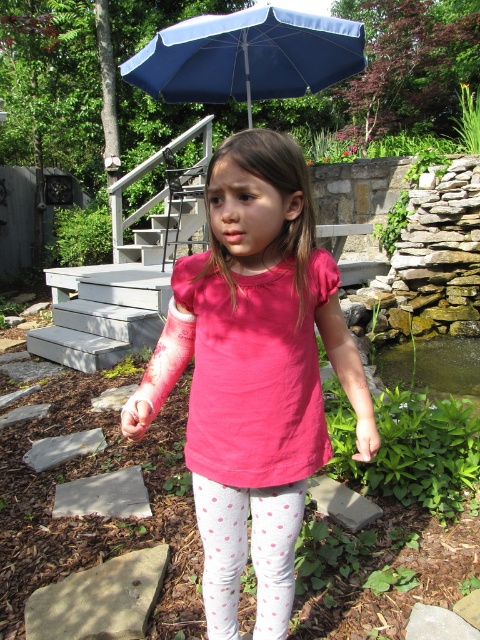
Measure the distance from pink fabric shirt at center to white polka dot leggings at lower center.

5.25 inches

Is point (289, 508) farther from camera compared to point (284, 556)?

No, (289, 508) is closer to viewer.

Does point (307, 168) come farther from viewer compared to point (285, 486)?

No.

Identify the location of pink fabric shirt at center. This screenshot has width=480, height=640. (253, 372).

Is point (159, 51) positioned behind point (216, 541)?

Yes, point (159, 51) is farther from viewer.

Can you confirm if blue fabric umbrella at upper center is positioned to the left of white polka dot leggings at lower center?

In fact, blue fabric umbrella at upper center is to the right of white polka dot leggings at lower center.

Locate an element on the screen. blue fabric umbrella at upper center is located at coordinates (247, 56).

Locate an element on the screen. The height and width of the screenshot is (640, 480). pink fabric shirt at center is located at coordinates (253, 372).

Consider the image. Can you confirm if pink fabric shirt at center is positioned to the left of blue fabric umbrella at upper center?

Indeed, pink fabric shirt at center is positioned on the left side of blue fabric umbrella at upper center.

The width and height of the screenshot is (480, 640). I want to click on pink fabric shirt at center, so click(x=253, y=372).